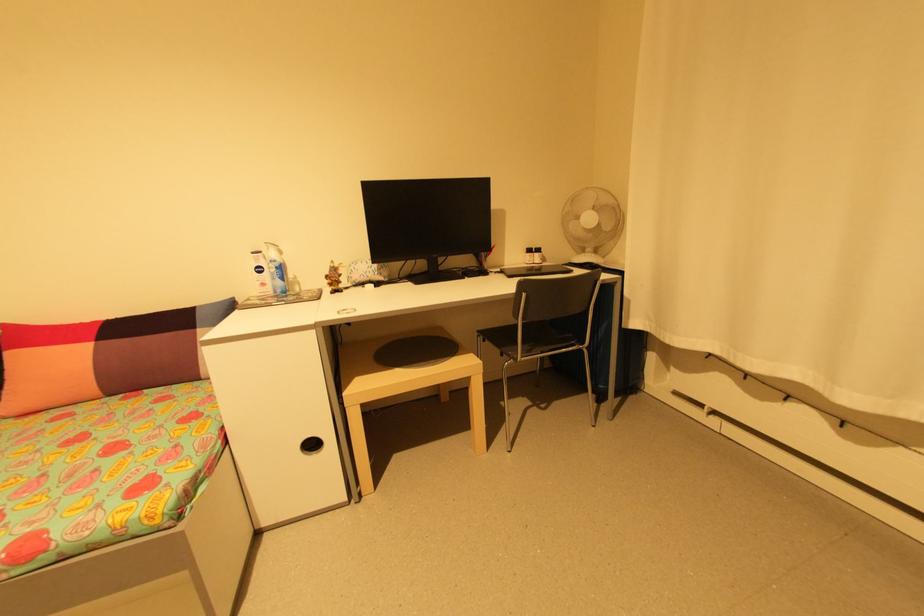
What do you see at coordinates (886, 471) in the screenshot? I see `the radiator handle` at bounding box center [886, 471].